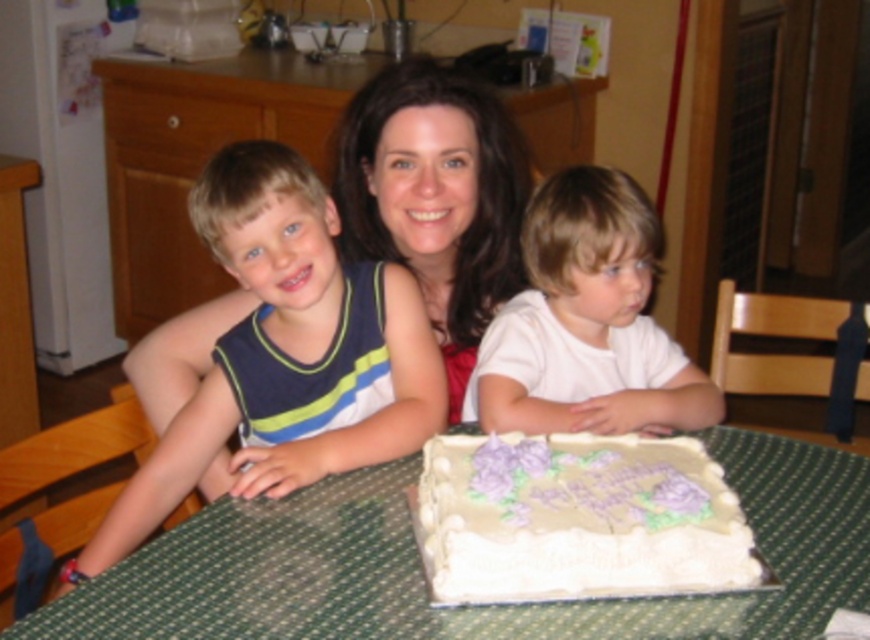
Question: Which point appears farthest from the camera in this image?

Choices:
 (A) (714, 563)
 (B) (206, 221)

Answer: (B)

Question: Which object is positioned farthest from the green fabric table at center?

Choices:
 (A) white matte shirt at right
 (B) white frosted cake at center

Answer: (A)

Question: Is green fabric table at center closer to the viewer compared to white frosted cake at center?

Choices:
 (A) yes
 (B) no

Answer: (A)

Question: Which point is farther to the camera?

Choices:
 (A) (436, 429)
 (B) (671, 468)

Answer: (A)

Question: Can you confirm if blue striped tank top at left is smaller than white frosted cake at center?

Choices:
 (A) no
 (B) yes

Answer: (A)

Question: Does blue striped tank top at left come behind white frosted cake at center?

Choices:
 (A) yes
 (B) no

Answer: (A)